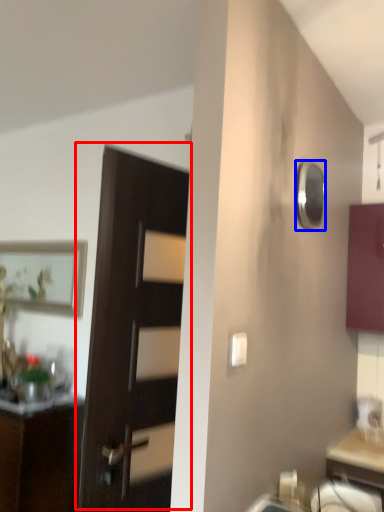
Question: Which object is further to the camera taking this photo, door (highlighted by a red box) or mirror (highlighted by a blue box)?

Choices:
 (A) door
 (B) mirror

Answer: (B)